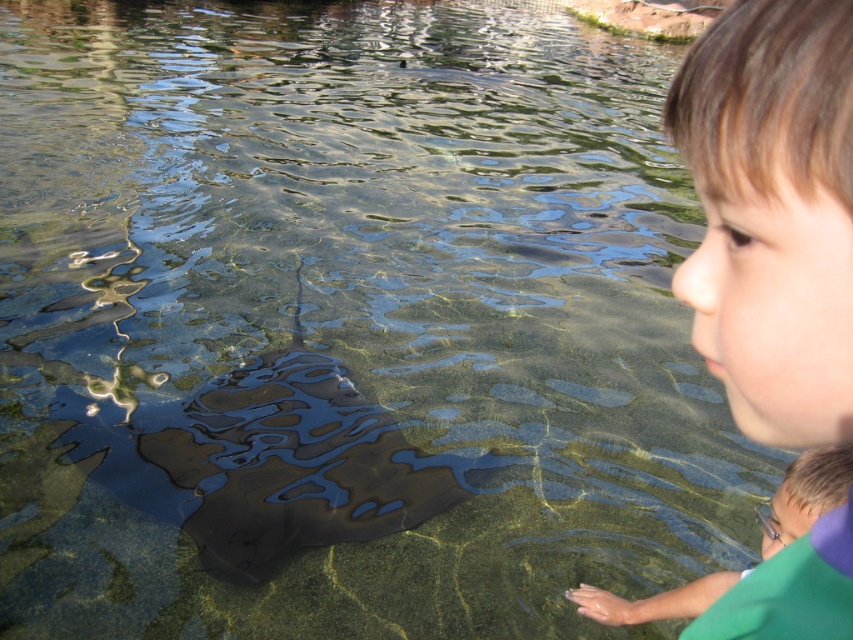
You are a zookeeper who needs to identify the size relationship between the smooth skin face at upper right and the green matte shirt at lower right. Which object is smaller?

The smooth skin face at upper right is smaller than the green matte shirt at lower right according to the description.

You are a zookeeper who needs to ensure the safety of visitors. You notice the smooth skin face at upper right and the shiny black stingray at center in the enclosure. Which object is closer to the right edge of the enclosure?

The smooth skin face at upper right is closer to the right edge of the enclosure because it is positioned to the right of the shiny black stingray at center.

You are a zookeeper who needs to ensure that the smooth skin face at upper right and the shiny black stingray at center are visible to visitors. Given their sizes, which object requires a larger viewing area to accommodate its width?

The shiny black stingray at center requires a larger viewing area because it has a greater width than the smooth skin face at upper right.